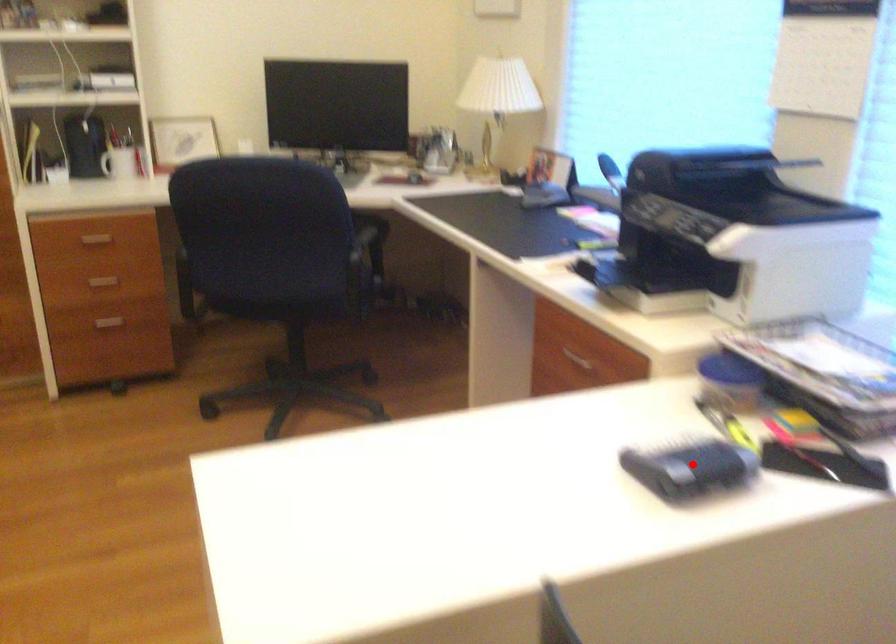
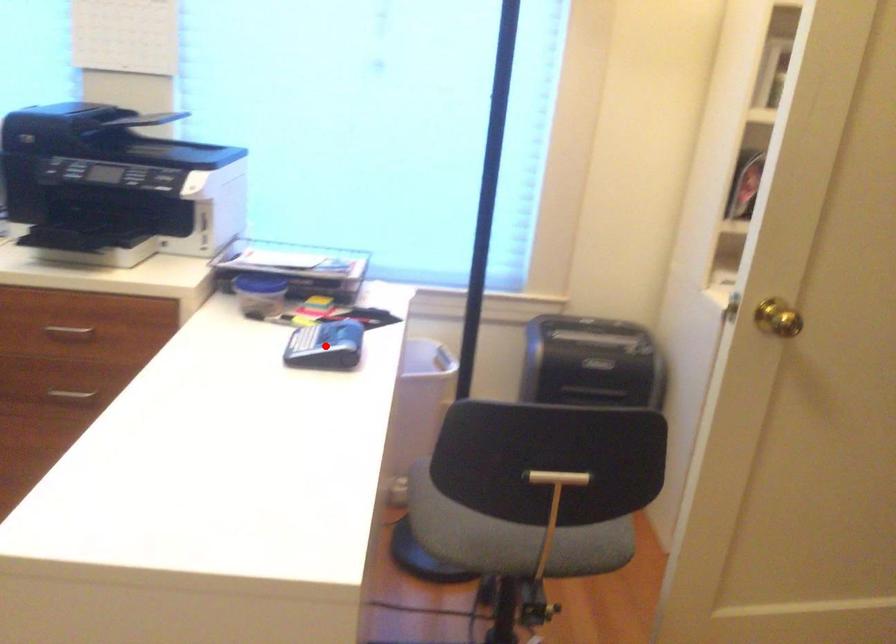
Consider the image. I am providing you with two images of the same scene from different viewpoints. A red point is marked on the first image and another point is marked on the second image. Are the points marked in image1 and image2 representing the same 3D position?

Yes